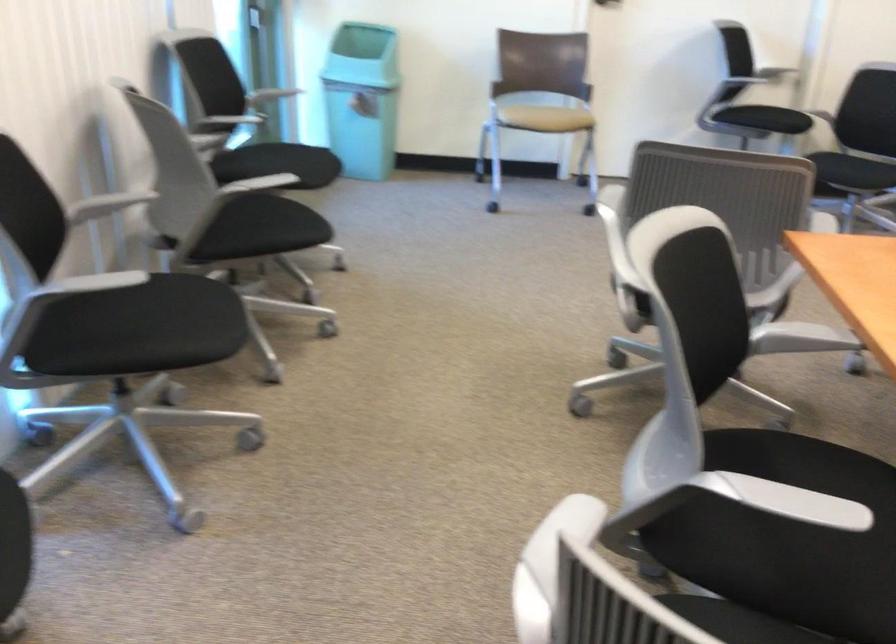
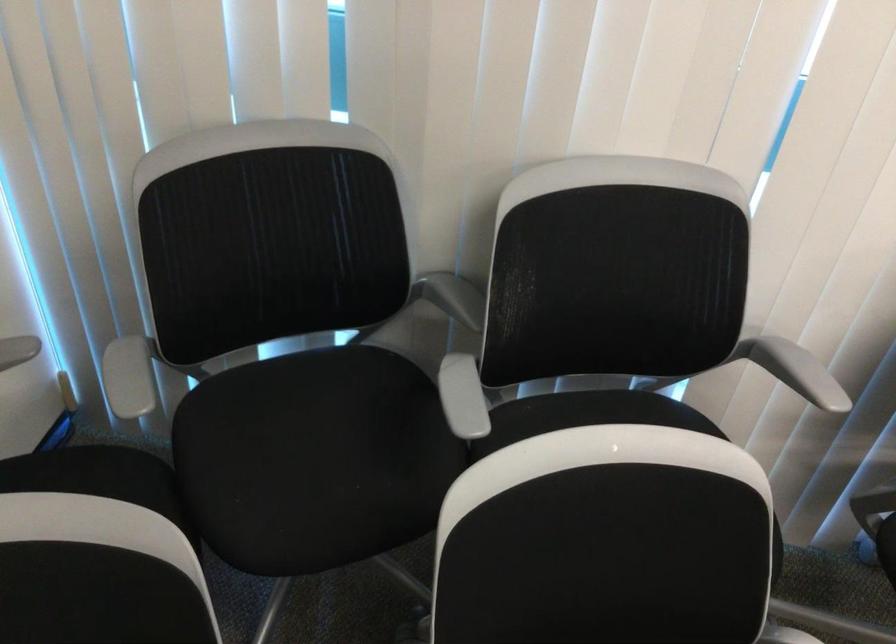
First-person continuous shooting, in which direction is the camera rotating?

The camera rotated toward left-down.